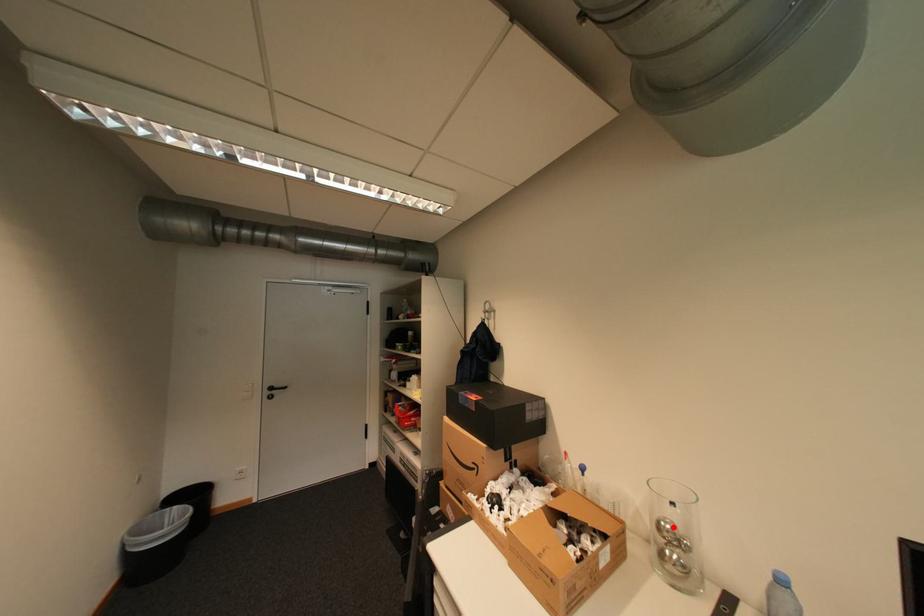
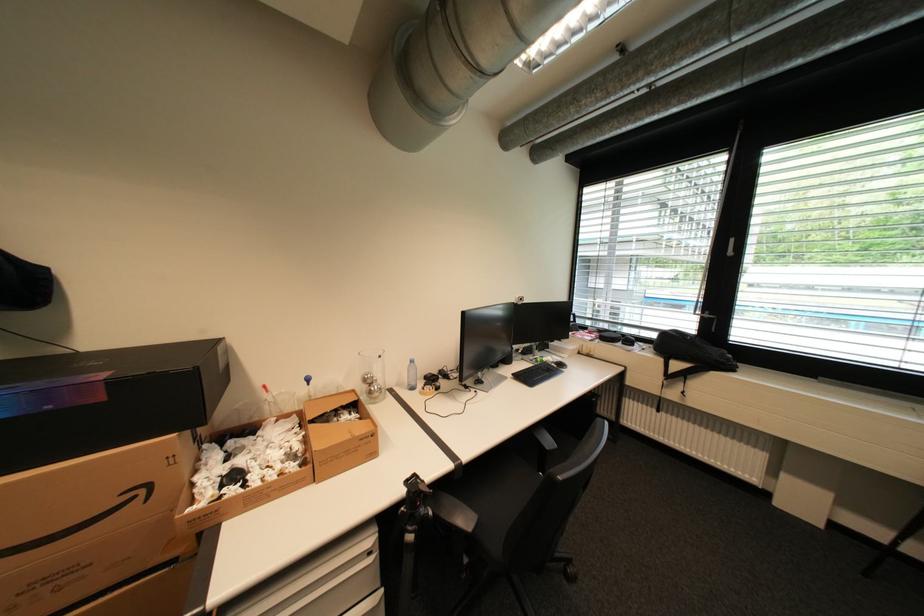
Where in the second image is the point corresponding to the highlighted location from the first image?

(377, 378)